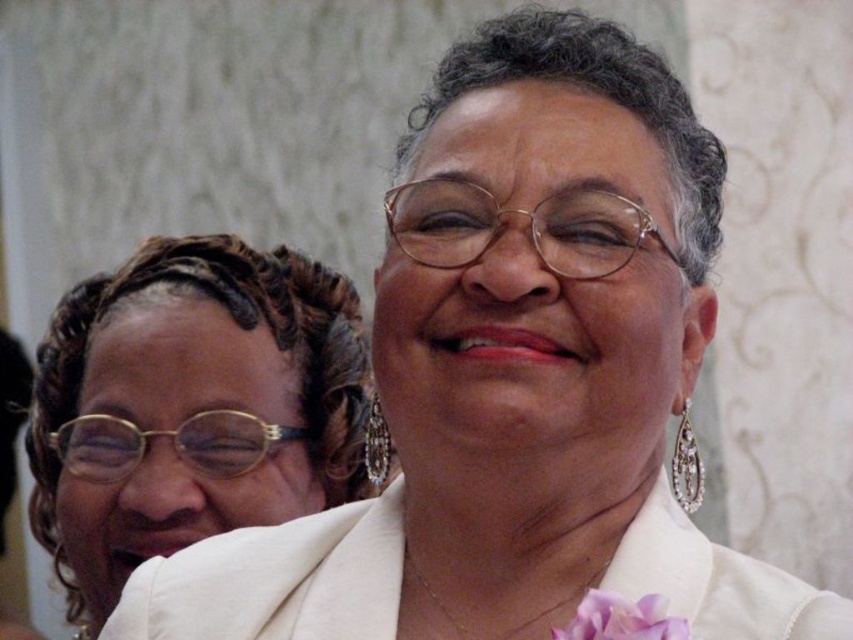
Does matte gold glasses at upper left have a smaller size compared to white satin robe at center?

No, matte gold glasses at upper left is not smaller than white satin robe at center.

Between matte gold glasses at upper left and white satin robe at center, which one has less height?

Standing shorter between the two is white satin robe at center.

Is point (173, 321) closer to camera compared to point (370, 561)?

No, (173, 321) is further to viewer.

This screenshot has height=640, width=853. I want to click on matte gold glasses at upper left, so click(194, 403).

Is point (175, 520) less distant than point (664, 604)?

No, (175, 520) is further to viewer.

Who is more distant from viewer, (276, 417) or (653, 612)?

Positioned behind is point (276, 417).

In order to click on matte gold glasses at upper left in this screenshot , I will do pyautogui.click(x=194, y=403).

Between white satin robe at center and purple silk flower at lower center, which one appears on the left side from the viewer's perspective?

From the viewer's perspective, white satin robe at center appears more on the left side.

Can you confirm if white satin robe at center is positioned above purple silk flower at lower center?

Actually, white satin robe at center is below purple silk flower at lower center.

Image resolution: width=853 pixels, height=640 pixels. Find the location of `white satin robe at center`. white satin robe at center is located at coordinates (276, 580).